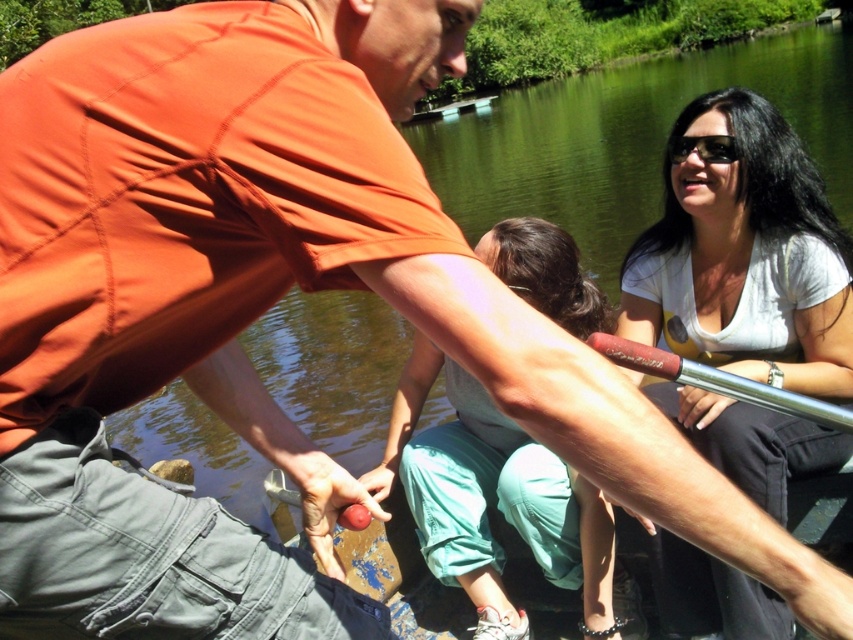
Question: Which point appears closest to the camera in this image?

Choices:
 (A) (788, 472)
 (B) (666, 356)

Answer: (B)

Question: Can you confirm if white matte shirt at upper right is bigger than rubberized red paddle at center?

Choices:
 (A) yes
 (B) no

Answer: (A)

Question: Can you confirm if white matte shirt at upper right is positioned above rubberized red paddle at center?

Choices:
 (A) yes
 (B) no

Answer: (A)

Question: Is white matte shirt at upper right closer to the viewer compared to rubberized red paddle at center?

Choices:
 (A) no
 (B) yes

Answer: (A)